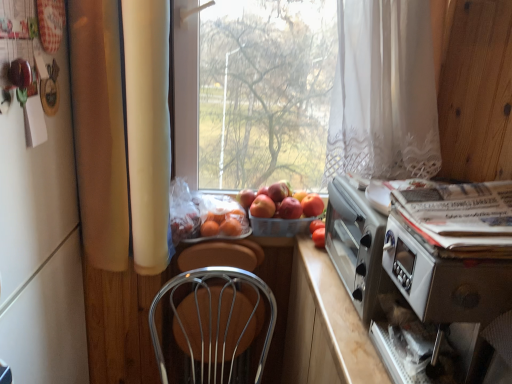
Question: Can you confirm if red matte apple at center, the 2th apple viewed from the left, is bigger than red matte apple at center, the second apple when ordered from right to left?

Choices:
 (A) yes
 (B) no

Answer: (A)

Question: Is red matte apple at center, arranged as the 3th apple when viewed from the left, inside red matte apple at center, the 2th apple viewed from the left?

Choices:
 (A) no
 (B) yes

Answer: (A)

Question: From a real-world perspective, is red matte apple at center, the 3th apple viewed from the right, positioned under red matte apple at center, arranged as the 3th apple when viewed from the left, based on gravity?

Choices:
 (A) yes
 (B) no

Answer: (B)

Question: Is red matte apple at center, the 2th apple viewed from the left, not within red matte apple at center, arranged as the 3th apple when viewed from the left?

Choices:
 (A) yes
 (B) no

Answer: (A)

Question: Does red matte apple at center, the 2th apple viewed from the left, have a smaller size compared to red matte apple at center, arranged as the 3th apple when viewed from the left?

Choices:
 (A) no
 (B) yes

Answer: (A)

Question: From the image's perspective, is red matte apple at center, the 2th apple viewed from the left, above or below white glossy magazine at right?

Choices:
 (A) below
 (B) above

Answer: (B)

Question: Considering the relative positions of red matte apple at center, the 3th apple viewed from the right, and white glossy magazine at right in the image provided, is red matte apple at center, the 3th apple viewed from the right, to the left or to the right of white glossy magazine at right?

Choices:
 (A) left
 (B) right

Answer: (A)

Question: Is red matte apple at center, the 3th apple viewed from the right, taller or shorter than white glossy magazine at right?

Choices:
 (A) tall
 (B) short

Answer: (B)

Question: In terms of size, does red matte apple at center, the 3th apple viewed from the right, appear bigger or smaller than white glossy magazine at right?

Choices:
 (A) small
 (B) big

Answer: (A)

Question: From a real-world perspective, is plastic basket at center positioned above or below orange matte at center, placed as the 2th fruit when sorted from right to left?

Choices:
 (A) below
 (B) above

Answer: (A)

Question: Based on their positions, is plastic basket at center located to the left or right of orange matte at center, which ranks as the 1th fruit in left-to-right order?

Choices:
 (A) left
 (B) right

Answer: (B)

Question: Considering the positions of plastic basket at center and orange matte at center, placed as the 2th fruit when sorted from right to left, in the image, is plastic basket at center wider or thinner than orange matte at center, placed as the 2th fruit when sorted from right to left,?

Choices:
 (A) thin
 (B) wide

Answer: (B)

Question: Is plastic basket at center in front of or behind orange matte at center, placed as the 2th fruit when sorted from right to left, in the image?

Choices:
 (A) behind
 (B) front

Answer: (A)

Question: Considering their positions, is red matte apple at center, positioned as the 1th apple in left-to-right order, located in front of or behind red matte apple at center, arranged as the 3th apple when viewed from the left?

Choices:
 (A) behind
 (B) front

Answer: (A)

Question: Is red matte apple at center, the 4th apple in the right-to-left sequence, taller or shorter than red matte apple at center, arranged as the 3th apple when viewed from the left?

Choices:
 (A) tall
 (B) short

Answer: (A)